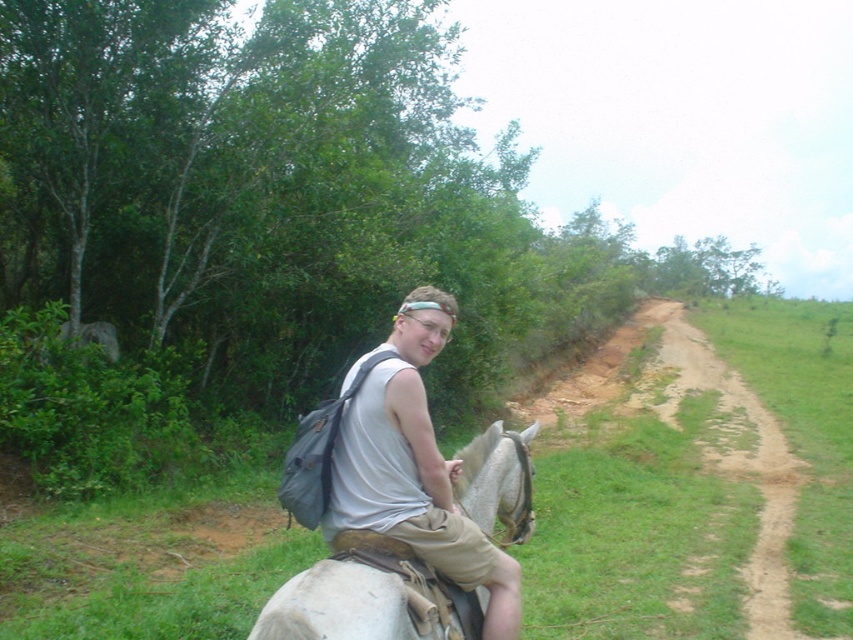
You are a hiker who wants to take a photo of the white matte horse at center and the gray fabric backpack at center. Which object should you focus on first if you want to capture both in the same frame without moving your camera?

You should focus on the gray fabric backpack at center first because the white matte horse at center is behind it, so focusing on the closer object will keep both in focus if they are in the same plane or depth of field.

You are a hiker planning to walk along the brown dirt path at center right. There is a gray fabric backpack at center in your way. Can you walk around it without stepping off the path?

The gray fabric backpack at center is positioned over brown dirt path at center right, so you cannot walk around it without stepping off the path.

You are a hiker who needs to pack your gear. You see the gray fabric backpack at center and the white matte horse at center in the scene. Which item can you use to carry your belongings?

The gray fabric backpack at center is bigger than the white matte horse at center, so you can use the gray fabric backpack at center to carry your belongings since it is larger and more suitable for holding gear.